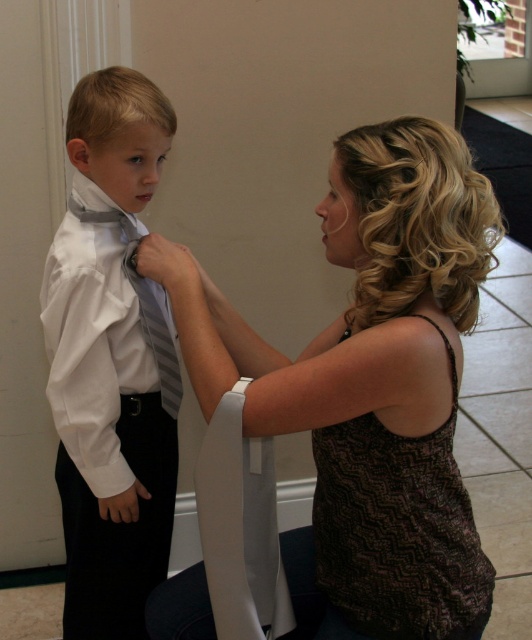
In the scene shown: You are a tailor observing the scene and need to determine which tie has a greater width. The options are the matte gray tie at left and the striped fabric tie at center. Based on the description, which one is wider?

The matte gray tie at left is wider than the striped fabric tie at center according to the description.

You are a photographer who needs to adjust the lighting for a photo shoot. You notice the matte brown tank top at center and the matte gray tie at left. Which object should you focus on if you want to highlight the one that is positioned to the right?

The matte brown tank top at center should be focused on because it is positioned to the right of the matte gray tie at left.